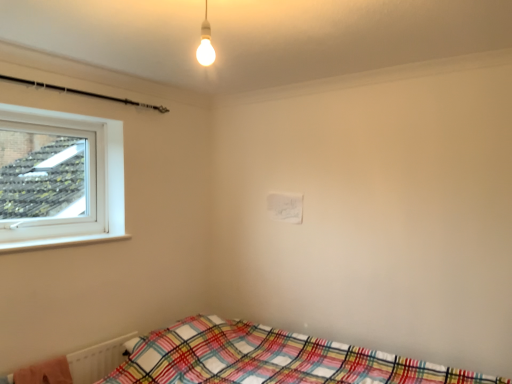
Question: Can you confirm if plaid fabric bed at lower right is shorter than matte white bulb at upper center?

Choices:
 (A) no
 (B) yes

Answer: (A)

Question: Does plaid fabric bed at lower right appear on the left side of matte white bulb at upper center?

Choices:
 (A) no
 (B) yes

Answer: (A)

Question: Is plaid fabric bed at lower right not near matte white bulb at upper center?

Choices:
 (A) yes
 (B) no

Answer: (A)

Question: Could matte white bulb at upper center be considered to be inside plaid fabric bed at lower right?

Choices:
 (A) yes
 (B) no

Answer: (B)

Question: Is matte white bulb at upper center at the back of plaid fabric bed at lower right?

Choices:
 (A) no
 (B) yes

Answer: (A)

Question: From a real-world perspective, relative to plaid fabric bed at lower right, is matte white bulb at upper center vertically above or below?

Choices:
 (A) below
 (B) above

Answer: (B)

Question: Considering their positions, is matte white bulb at upper center located in front of or behind plaid fabric bed at lower right?

Choices:
 (A) behind
 (B) front

Answer: (A)

Question: Do you think matte white bulb at upper center is within plaid fabric bed at lower right, or outside of it?

Choices:
 (A) inside
 (B) outside

Answer: (B)

Question: Would you say matte white bulb at upper center is to the left or to the right of plaid fabric bed at lower right in the picture?

Choices:
 (A) left
 (B) right

Answer: (A)

Question: Is plaid fabric blanket at lower left wider or thinner than matte white bulb at upper center?

Choices:
 (A) thin
 (B) wide

Answer: (B)

Question: From the image's perspective, is plaid fabric blanket at lower left located above or below matte white bulb at upper center?

Choices:
 (A) above
 (B) below

Answer: (B)

Question: Is plaid fabric blanket at lower left to the left or to the right of matte white bulb at upper center in the image?

Choices:
 (A) right
 (B) left

Answer: (B)

Question: Relative to matte white bulb at upper center, is plaid fabric blanket at lower left in front or behind?

Choices:
 (A) behind
 (B) front

Answer: (A)

Question: In terms of width, does plaid fabric bed at lower right look wider or thinner when compared to plaid fabric blanket at lower left?

Choices:
 (A) wide
 (B) thin

Answer: (A)

Question: Based on their sizes in the image, would you say plaid fabric bed at lower right is bigger or smaller than plaid fabric blanket at lower left?

Choices:
 (A) big
 (B) small

Answer: (A)